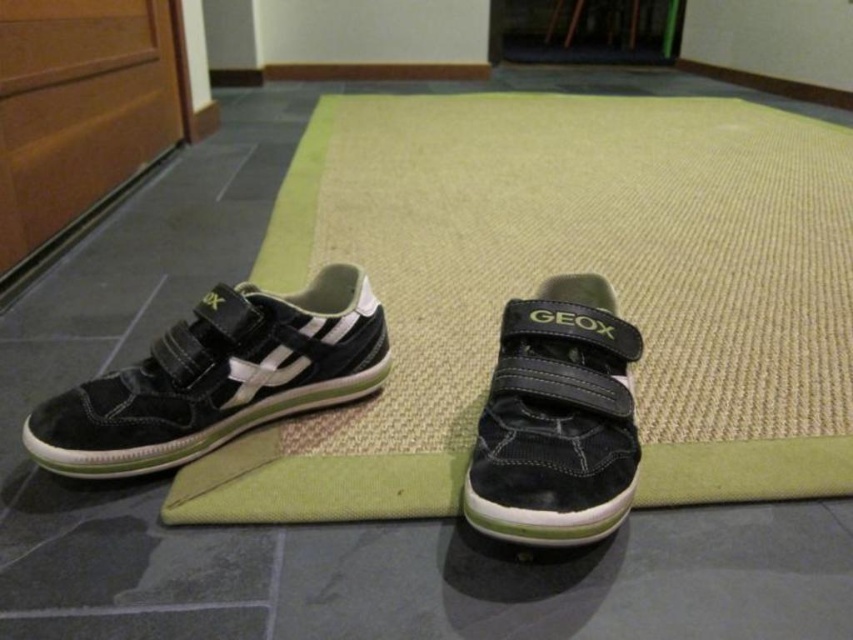
Does green woven mat at center appear under suede/black velcro strap sneaker at left?

Incorrect, green woven mat at center is not positioned below suede/black velcro strap sneaker at left.

Does green woven mat at center have a lesser width compared to suede/black velcro strap sneaker at left?

No.

Measure the distance between green woven mat at center and camera.

A distance of 34.30 inches exists between green woven mat at center and camera.

The height and width of the screenshot is (640, 853). What are the coordinates of `green woven mat at center` in the screenshot? It's located at pyautogui.click(x=556, y=272).

Which is in front, point (293, 433) or point (589, 481)?

Point (589, 481)

Does green woven mat at center have a larger size compared to suede/black sneaker at center?

Correct, green woven mat at center is larger in size than suede/black sneaker at center.

Between point (659, 147) and point (544, 480), which one is positioned in front?

Point (544, 480) is more forward.

Identify the location of green woven mat at center. click(556, 272).

Is suede/black velcro strap sneaker at left above suede/black sneaker at center?

Incorrect, suede/black velcro strap sneaker at left is not positioned above suede/black sneaker at center.

Is the position of suede/black velcro strap sneaker at left less distant than that of suede/black sneaker at center?

No.

Measure the distance between suede/black velcro strap sneaker at left and camera.

The distance of suede/black velcro strap sneaker at left from camera is 34.96 inches.

The image size is (853, 640). Identify the location of suede/black velcro strap sneaker at left. (218, 378).